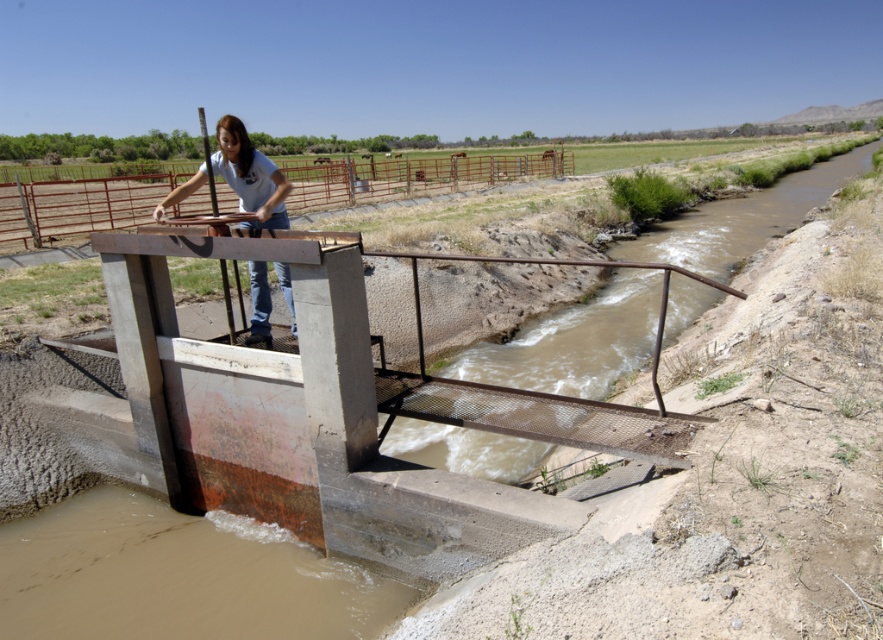
Question: Which object appears closest to the camera in this image?

Choices:
 (A) rusty metal rail at upper center
 (B) brown concrete stream at center
 (C) matte blue shirt at center

Answer: (C)

Question: Is brown concrete stream at center below matte blue shirt at center?

Choices:
 (A) no
 (B) yes

Answer: (A)

Question: Which point is farther to the camera?

Choices:
 (A) rusty metal rail at upper center
 (B) matte blue shirt at center

Answer: (A)

Question: Does rusty metal rail at upper center come in front of matte blue shirt at center?

Choices:
 (A) no
 (B) yes

Answer: (A)

Question: Which is nearer to the brown concrete stream at center?

Choices:
 (A) matte blue shirt at center
 (B) rusty metal rail at upper center

Answer: (A)

Question: From the image, what is the correct spatial relationship of brown concrete stream at center in relation to rusty metal rail at upper center?

Choices:
 (A) above
 (B) below

Answer: (B)